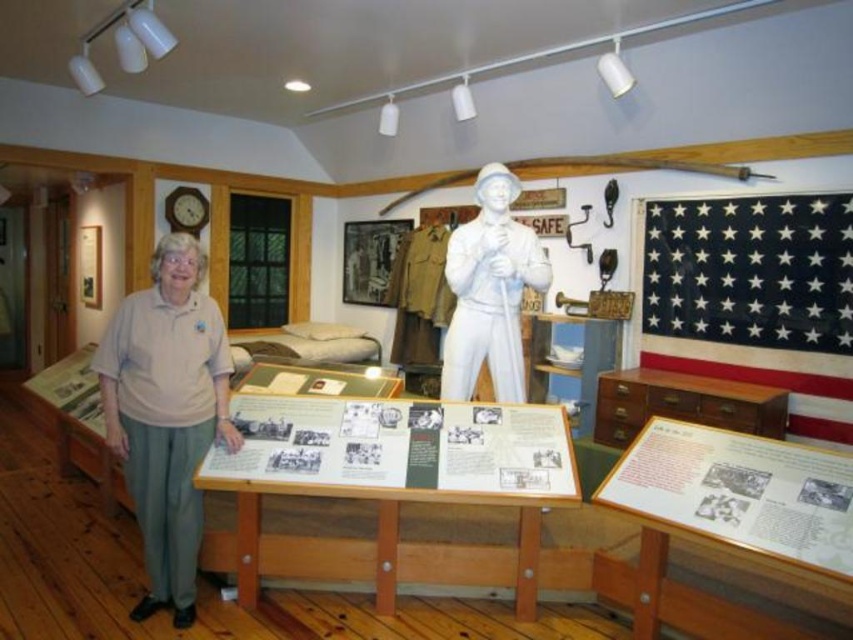
You are a visitor in the museum and want to take a photo of both the white cotton shirt at left and the white glossy statue at center. Which object should you position closer to the left side of your camera frame to include both in the photo?

To include both the white cotton shirt at left and the white glossy statue at center in your photo, position the white cotton shirt at left closer to the left side of your camera frame since it is already to the left of the white glossy statue at center.

You are a visitor in the museum and you see the black cotton flag at upper right and the white cotton shirt at left. Which one is located more to the right side of the scene?

The black cotton flag at upper right is more to the right side of the scene because it is positioned on the right side of the white cotton shirt at left.

You are a visitor in the museum and want to take a photo of both the white cotton shirt at left and the white glossy statue at center in the same frame. The camera you have can capture objects within a 5 feet range. Can you position yourself so that both objects are within the camera range?

The white cotton shirt at left is 4.52 feet away from the white glossy statue at center. Since the distance between them is within the 5 feet range of the camera, you can position yourself between them to ensure both are within the camera range.